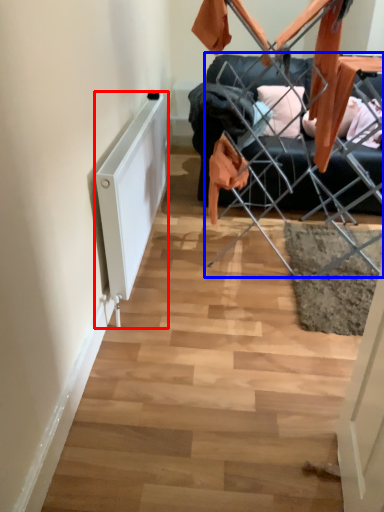
Question: Which object appears farthest to the camera in this image, radiator (highlighted by a red box) or furniture (highlighted by a blue box)?

Choices:
 (A) radiator
 (B) furniture

Answer: (B)